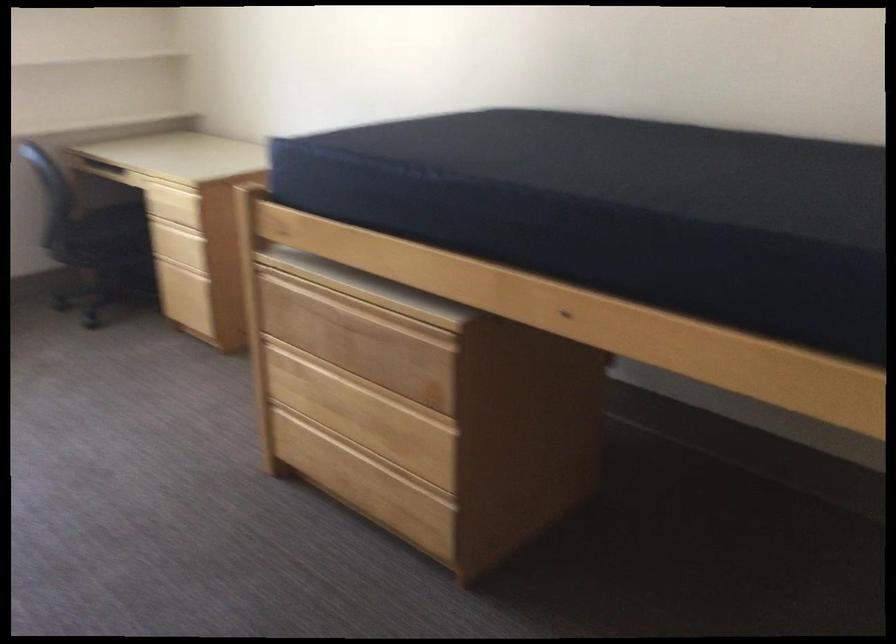
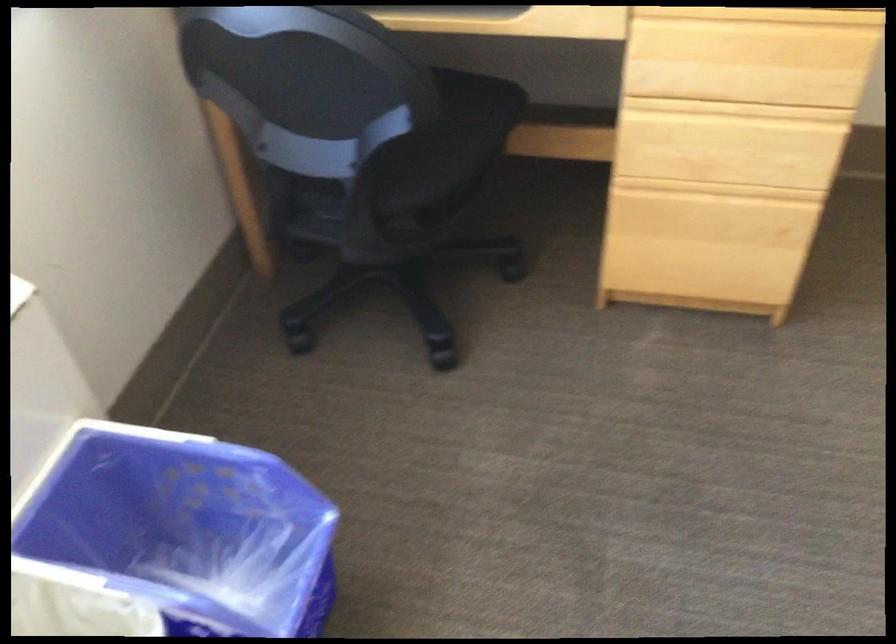
Find the pixel in the second image that matches pixel 177 221 in the first image.

(736, 109)